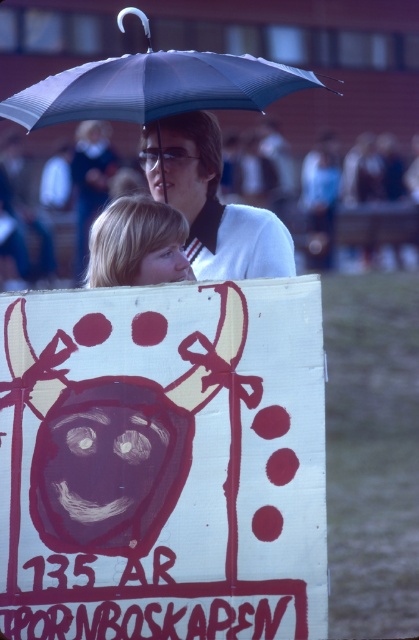
Between white paper sign at center and matte black umbrella at upper center, which one has less height?

Standing shorter between the two is white paper sign at center.

Can you confirm if white paper sign at center is positioned to the left of matte black umbrella at upper center?

Yes, white paper sign at center is to the left of matte black umbrella at upper center.

Is point (20, 428) positioned after point (114, 60)?

No, (20, 428) is in front of (114, 60).

At what (x,y) coordinates should I click in order to perform the action: click on white paper sign at center. Please return your answer as a coordinate pair (x, y). Looking at the image, I should click on (163, 464).

Is point (79, 81) positioned behind point (75, 173)?

No.

Does matte black umbrella at upper center have a smaller size compared to matte white shirt at upper center?

Incorrect, matte black umbrella at upper center is not smaller in size than matte white shirt at upper center.

This screenshot has width=419, height=640. I want to click on matte black umbrella at upper center, so click(155, 88).

Can you confirm if matte black umbrella at upper center is bigger than blonde hair at lower left?

Yes.

Which is above, matte black umbrella at upper center or blonde hair at lower left?

Positioned higher is matte black umbrella at upper center.

Does point (199, 108) come closer to viewer compared to point (116, 244)?

No.

Where is `matte black umbrella at upper center`? The image size is (419, 640). matte black umbrella at upper center is located at coordinates (155, 88).